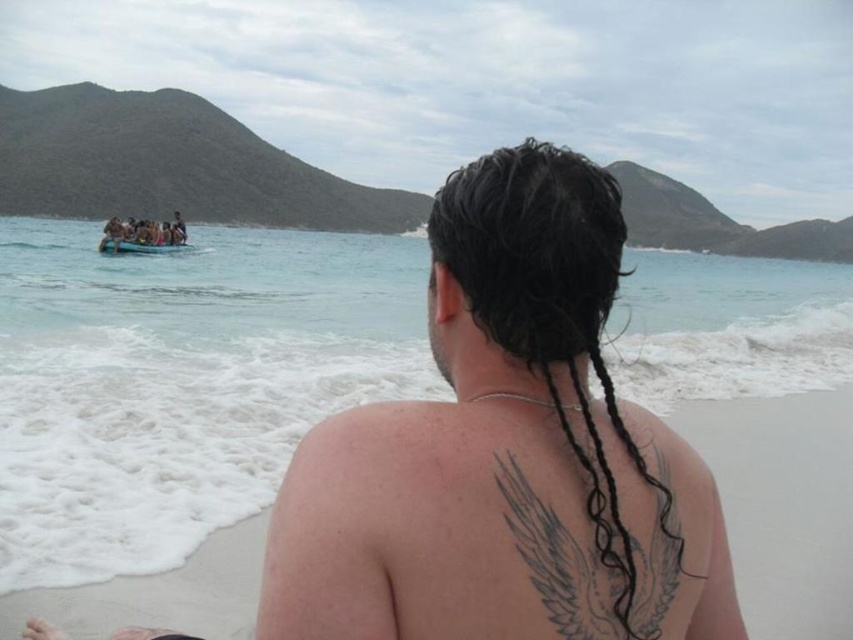
Question: Considering the real-world distances, which object is closest to the gray ink wings at back?

Choices:
 (A) blue plastic boat at left
 (B) clear blue water at center
 (C) dark hair at center

Answer: (C)

Question: From the image, what is the correct spatial relationship of clear blue water at center in relation to blue plastic boat at left?

Choices:
 (A) right
 (B) left

Answer: (A)

Question: Is clear blue water at center wider than dark hair at center?

Choices:
 (A) no
 (B) yes

Answer: (B)

Question: Which object is closer to the camera taking this photo?

Choices:
 (A) gray ink wings at back
 (B) dark hair at center
 (C) blue plastic boat at left

Answer: (B)

Question: Which object appears farthest from the camera in this image?

Choices:
 (A) dark hair at center
 (B) clear blue water at center
 (C) blue plastic boat at left
 (D) gray ink wings at back

Answer: (C)

Question: Is clear blue water at center bigger than blue plastic boat at left?

Choices:
 (A) yes
 (B) no

Answer: (A)